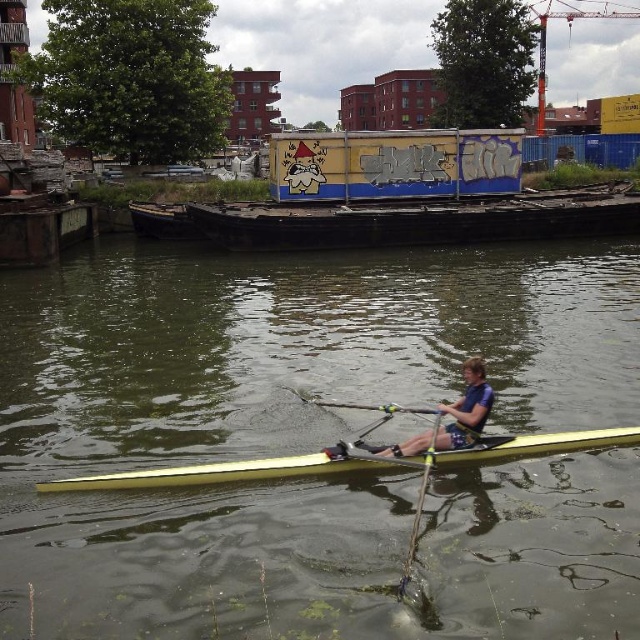
Question: Which object is farther from the camera taking this photo?

Choices:
 (A) blue fabric life vest at center
 (B) yellow glossy canoe at center
 (C) greenish murky water at center

Answer: (A)

Question: Which object is closer to the camera taking this photo?

Choices:
 (A) greenish murky water at center
 (B) yellow glossy canoe at center

Answer: (A)

Question: Is wooden boat at center wider than blue fabric life vest at center?

Choices:
 (A) yes
 (B) no

Answer: (A)

Question: Which of these objects is positioned closest to the yellow glossy canoe at center?

Choices:
 (A) greenish murky water at center
 (B) blue fabric life vest at center
 (C) yellow wood paddle at center
 (D) wooden boat at center

Answer: (B)

Question: Is yellow glossy canoe at center positioned at the back of yellow wood paddle at center?

Choices:
 (A) yes
 (B) no

Answer: (B)

Question: Does greenish murky water at center have a greater width compared to wooden boat at center?

Choices:
 (A) yes
 (B) no

Answer: (A)